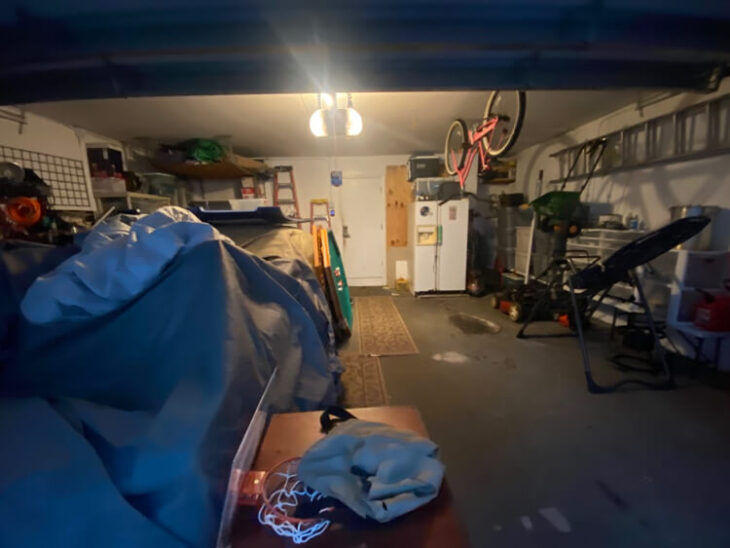
The height and width of the screenshot is (548, 730). Find the location of `drawers`. drawers is located at coordinates (683, 286).